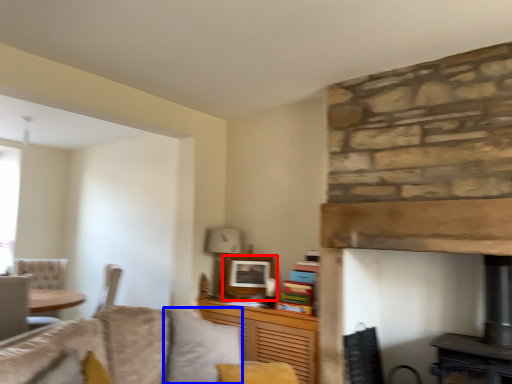
Question: Which object appears closest to the camera in this image, picture frame (highlighted by a red box) or pillow (highlighted by a blue box)?

Choices:
 (A) picture frame
 (B) pillow

Answer: (B)